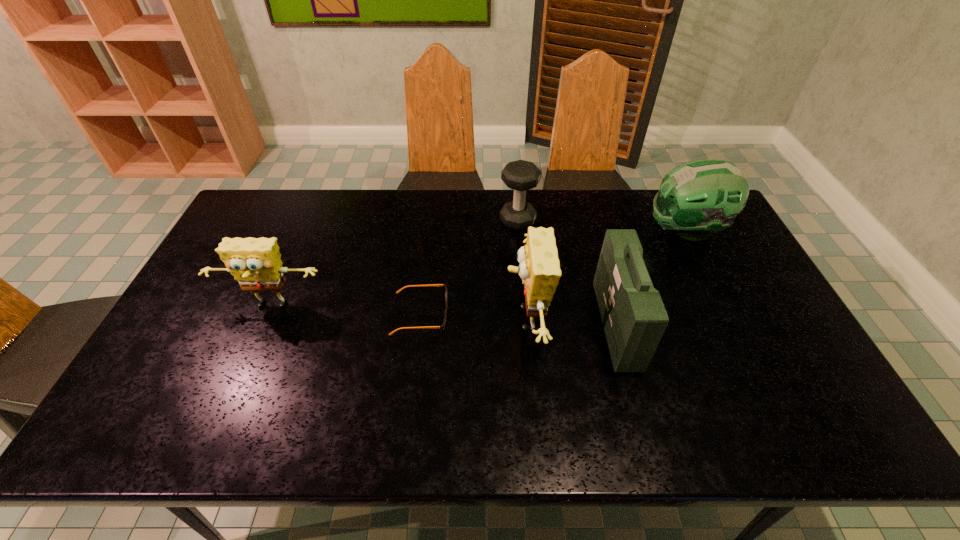
At what (x,y) coordinates should I click in order to perform the action: click on free space for a new sponge on the right. Please return your answer as a coordinate pair (x, y). The height and width of the screenshot is (540, 960). Looking at the image, I should click on (793, 334).